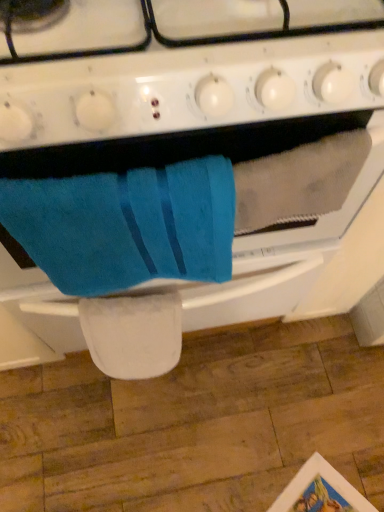
Question: Is point (228, 184) positioned closer to the camera than point (339, 2)?

Choices:
 (A) closer
 (B) farther

Answer: (A)

Question: From a real-world perspective, relative to white glossy gas stove at upper center, is blue soft towel at center vertically above or below?

Choices:
 (A) below
 (B) above

Answer: (A)

Question: Which object is positioned closest to the blue soft towel at center?

Choices:
 (A) white glossy gas stove at upper center
 (B) blue terry cloth towel at center

Answer: (B)

Question: Considering the real-world distances, which object is farthest from the blue soft towel at center?

Choices:
 (A) blue terry cloth towel at center
 (B) white glossy gas stove at upper center

Answer: (B)